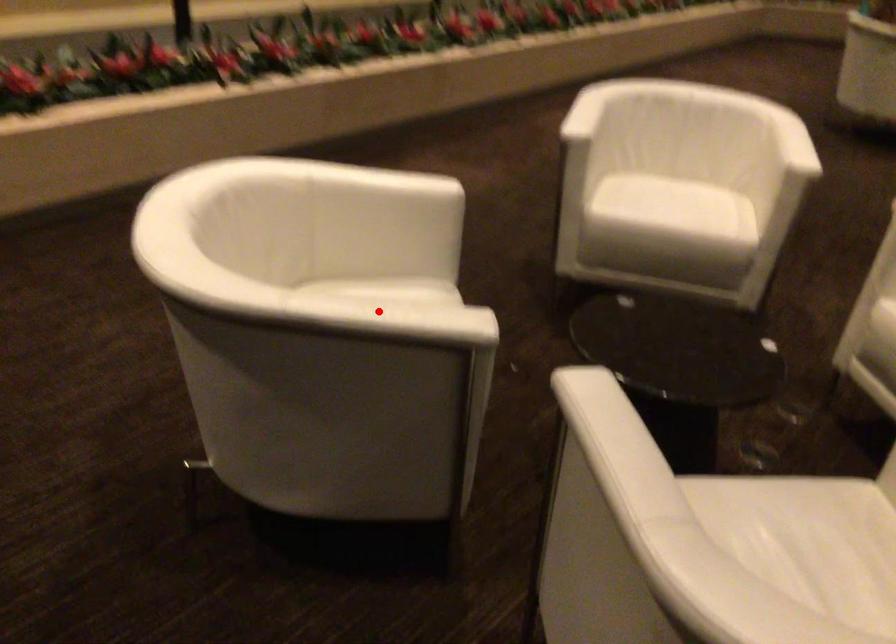
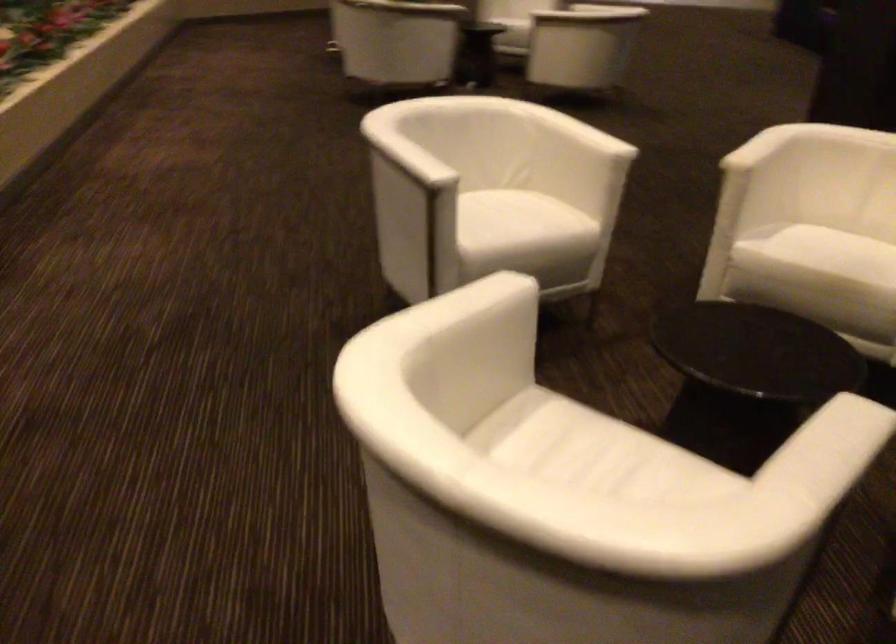
In the second image, find the point that corresponds to the highlighted location in the first image.

(839, 446)